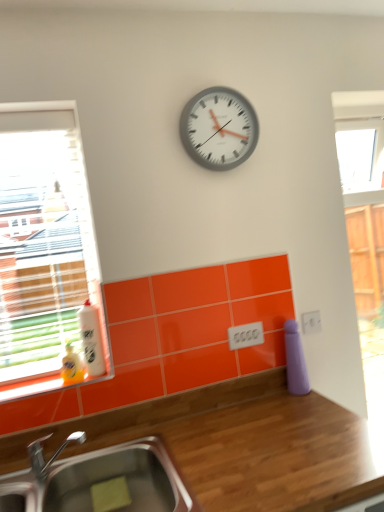
Question: From a real-world perspective, is white glossy bottle at left located beneath stainless steel sink at lower left?

Choices:
 (A) no
 (B) yes

Answer: (A)

Question: Could you tell me if white glossy bottle at left is facing stainless steel sink at lower left?

Choices:
 (A) no
 (B) yes

Answer: (A)

Question: From a real-world perspective, is white glossy bottle at left physically above stainless steel sink at lower left?

Choices:
 (A) yes
 (B) no

Answer: (A)

Question: Considering the relative sizes of white glossy bottle at left and stainless steel sink at lower left in the image provided, is white glossy bottle at left taller than stainless steel sink at lower left?

Choices:
 (A) no
 (B) yes

Answer: (A)

Question: Would you consider white glossy bottle at left to be distant from stainless steel sink at lower left?

Choices:
 (A) no
 (B) yes

Answer: (A)

Question: Is white glossy bottle at left completely or partially outside of stainless steel sink at lower left?

Choices:
 (A) yes
 (B) no

Answer: (A)

Question: Is white plastic clock at upper center outside of white glossy bottle at left?

Choices:
 (A) no
 (B) yes

Answer: (B)

Question: Does white plastic clock at upper center turn towards white glossy bottle at left?

Choices:
 (A) yes
 (B) no

Answer: (B)

Question: Can you confirm if white plastic clock at upper center is smaller than white glossy bottle at left?

Choices:
 (A) yes
 (B) no

Answer: (B)

Question: From a real-world perspective, is white plastic clock at upper center located higher than white glossy bottle at left?

Choices:
 (A) no
 (B) yes

Answer: (B)

Question: Is white glossy bottle at left at the back of white plastic clock at upper center?

Choices:
 (A) no
 (B) yes

Answer: (A)

Question: Does white plastic clock at upper center have a lesser width compared to white glossy bottle at left?

Choices:
 (A) no
 (B) yes

Answer: (B)

Question: Considering the relative sizes of wooden at upper center and clear glass window at left in the image provided, is wooden at upper center wider than clear glass window at left?

Choices:
 (A) no
 (B) yes

Answer: (B)